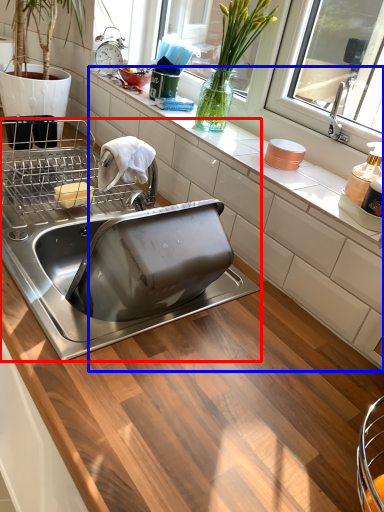
Question: Among these objects, which one is farthest to the camera, sink (highlighted by a red box) or countertop (highlighted by a blue box)?

Choices:
 (A) sink
 (B) countertop

Answer: (B)